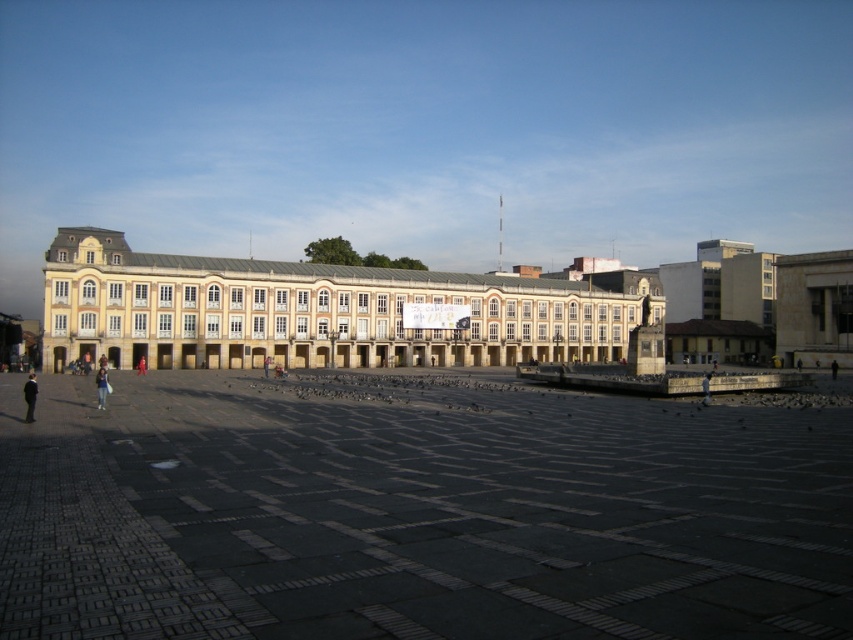
You are standing in the plaza and want to take a photo of the beige stone building at center. Which direction should you face to capture it in your camera view?

The beige stone building at center is located at point coordinates of (310, 310). This places it near the central area of the plaza. To capture it in your camera view, you should face towards the center of the plaza where the building stands.